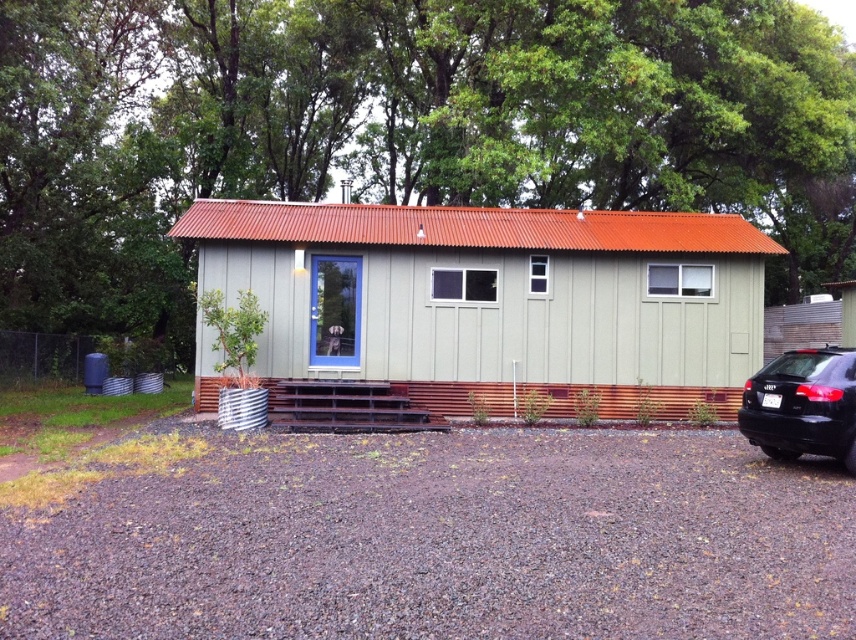
You are standing at point (496, 300) in the image. What object are you directly facing?

The point (496, 300) indicates the green corrugated metal hut at center, so you are directly facing the green corrugated metal hut at center.

You are standing in front of the building and want to determine the relative positions of two points marked in the image. Which point is closer to you, point 1 at coordinates (164, 3) or point 2 at coordinates (770, 368)?

Point 1 at coordinates (164, 3) is closer to you because it is further to the camera than point 2 at coordinates (770, 368).

You are standing in front of the building and notice two objects in the scene. One is a green leafy tree at upper center and the other is a green corrugated metal hut at center. Based on their positions, which one is located to the right of the other?

The green leafy tree at upper center is positioned to the right of the green corrugated metal hut at center.